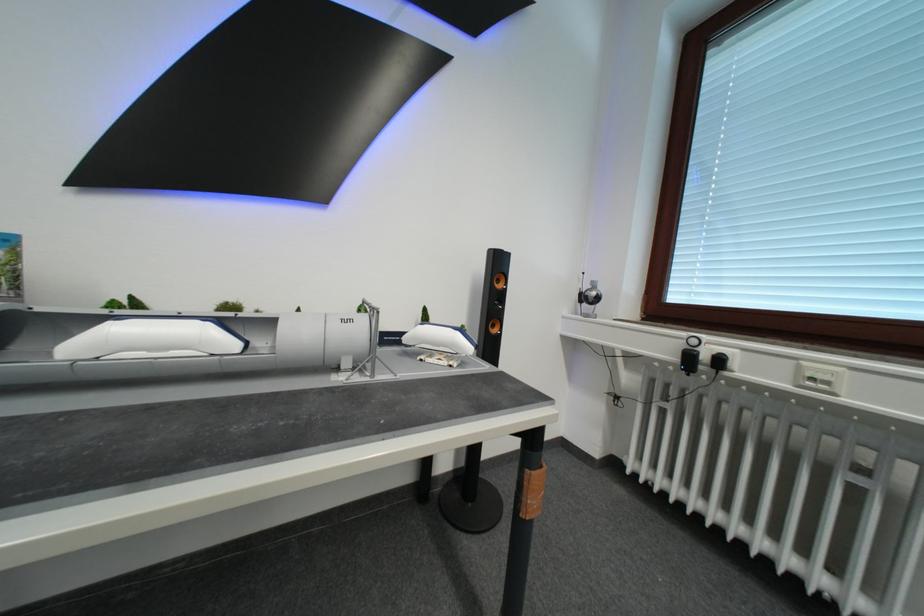
Identify the location of black wall plug. This screenshot has height=616, width=924. (688, 360).